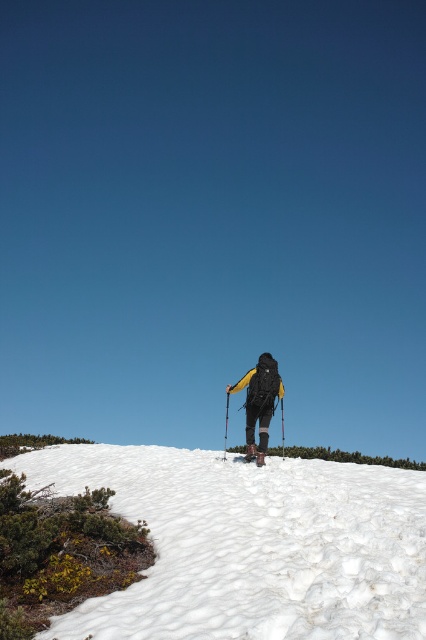
Does point (247, 385) come farther from viewer compared to point (282, 406)?

That is False.

Between matte black backpack at center and black plastic ski pole at center, which one is positioned higher?

matte black backpack at center is higher up.

The image size is (426, 640). I want to click on matte black backpack at center, so click(x=259, y=403).

Locate an element on the screen. Image resolution: width=426 pixels, height=640 pixels. matte black backpack at center is located at coordinates (259, 403).

Can you confirm if white fluffy snow at center is positioned to the right of black plastic ski pole at center?

Incorrect, white fluffy snow at center is not on the right side of black plastic ski pole at center.

How much distance is there between white fluffy snow at center and black plastic ski pole at center?

They are 8.70 feet apart.

Is point (207, 595) closer to viewer compared to point (282, 403)?

That is True.

Find the location of a particular element. white fluffy snow at center is located at coordinates (250, 545).

Can you confirm if white fluffy snow at center is positioned to the right of matte black backpack at center?

No, white fluffy snow at center is not to the right of matte black backpack at center.

Does white fluffy snow at center have a lesser height compared to matte black backpack at center?

Yes.

Who is more distant from viewer, (183, 536) or (258, 403)?

Point (258, 403)

At what (x,y) coordinates should I click in order to perform the action: click on white fluffy snow at center. Please return your answer as a coordinate pair (x, y). The width and height of the screenshot is (426, 640). Looking at the image, I should click on (250, 545).